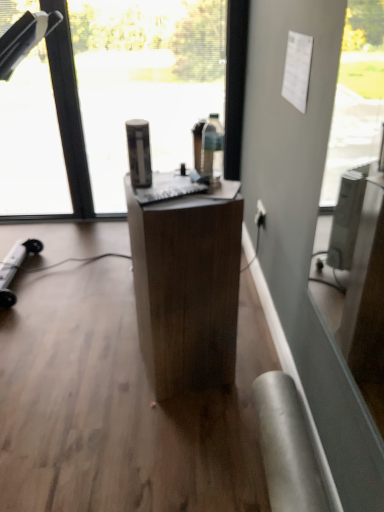
At what (x,y) coordinates should I click in order to perform the action: click on free space above wooden desk at center (from a real-world perspective). Please return your answer as a coordinate pair (x, y). Looking at the image, I should click on (168, 184).